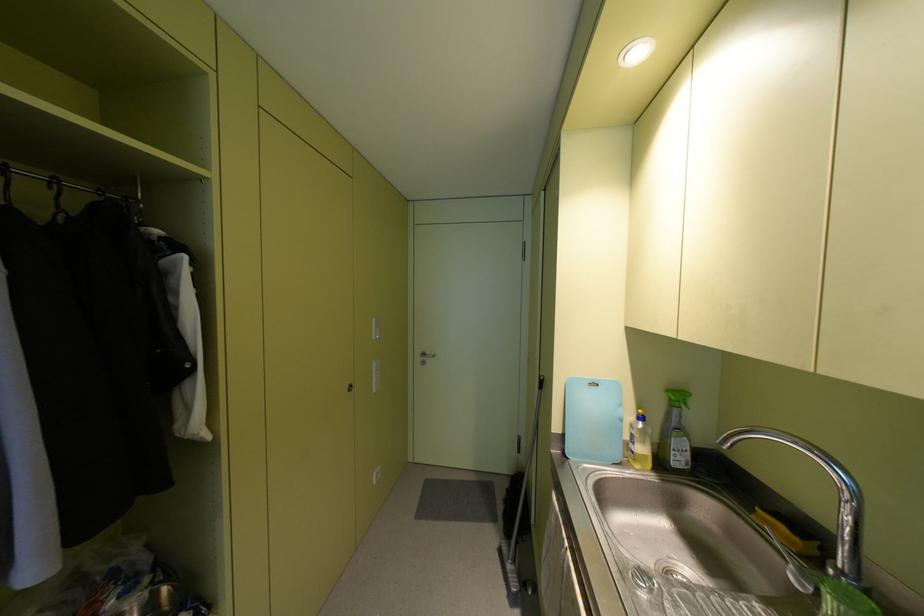
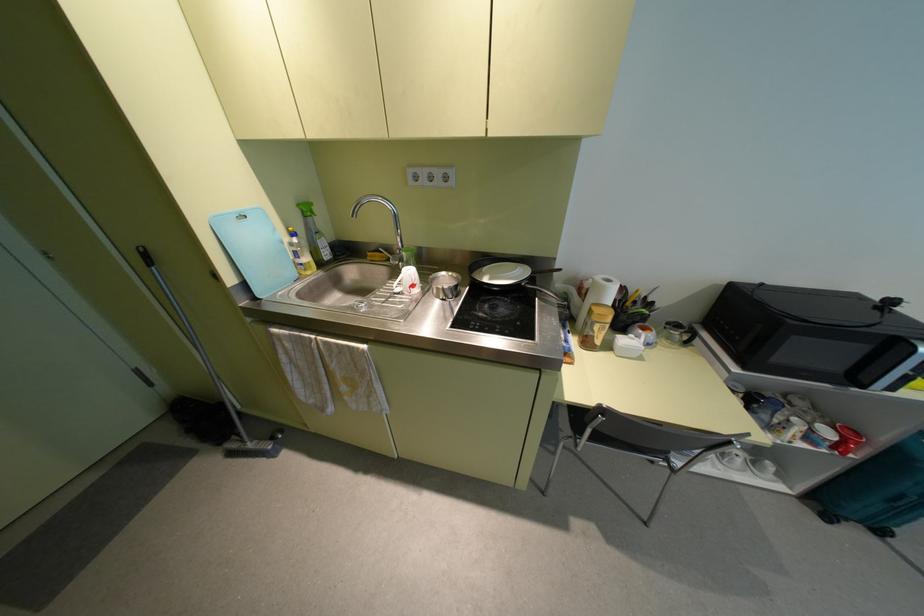
Locate, in the second image, the point that corresponds to pixel 675 403 in the first image.

(308, 214)